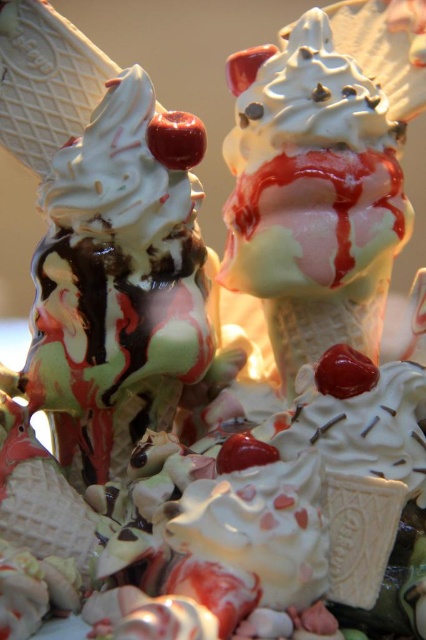
Question: Which is nearer to the shiny red cherry at center?

Choices:
 (A) swirled vanilla ice cream at center
 (B) white chocolate ice cream cone at center

Answer: (A)

Question: Does swirled vanilla ice cream at center have a lesser width compared to shiny red cherry at center?

Choices:
 (A) no
 (B) yes

Answer: (A)

Question: Which object is positioned closest to the shiny red cherry at center?

Choices:
 (A) swirled vanilla ice cream at center
 (B) white chocolate ice cream cone at center

Answer: (A)

Question: Is the position of swirled vanilla ice cream at center more distant than that of shiny red cherry at center?

Choices:
 (A) yes
 (B) no

Answer: (B)

Question: Based on their relative distances, which object is farther from the white chocolate ice cream cone at center?

Choices:
 (A) shiny red cherry at center
 (B) swirled vanilla ice cream at center

Answer: (A)

Question: Is swirled vanilla ice cream at center to the left of white chocolate ice cream cone at center from the viewer's perspective?

Choices:
 (A) no
 (B) yes

Answer: (B)